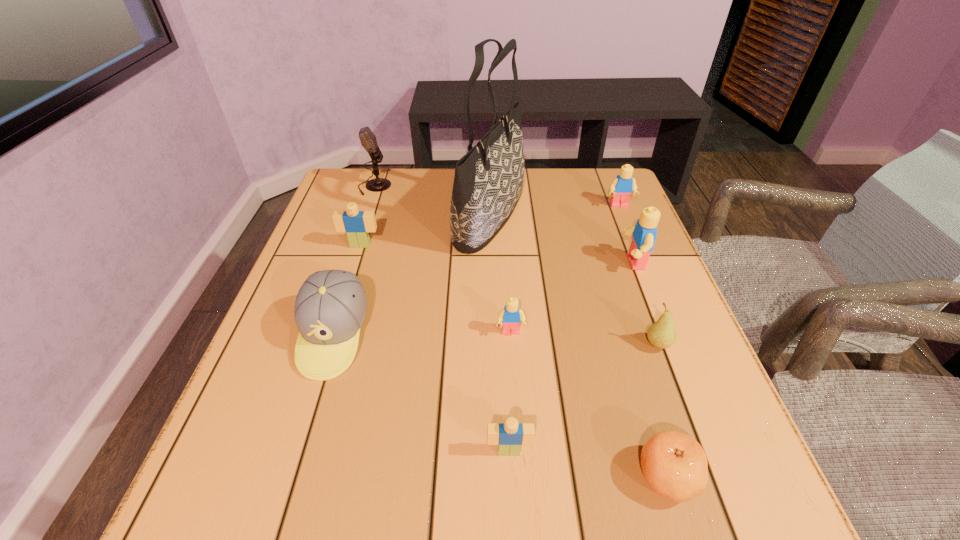
Identify the location of Lego located at the far edge. Image resolution: width=960 pixels, height=540 pixels. (622, 186).

At what (x,y) coordinates should I click in order to perform the action: click on object that is at the near edge. Please return your answer as a coordinate pair (x, y). This screenshot has height=540, width=960. Looking at the image, I should click on (674, 465).

Identify the location of microphone located in the left edge section of the desktop. (368, 140).

You are a GUI agent. You are given a task and a screenshot of the screen. Output one action in this format:
    pyautogui.click(x=<x>, y=<y>)
    Task: Click on the Lego that is at the left edge
    
    Given the screenshot: What is the action you would take?
    pyautogui.click(x=356, y=224)

This screenshot has width=960, height=540. What are the coordinates of `baseball cap located at the left edge` in the screenshot? It's located at (330, 308).

This screenshot has width=960, height=540. What are the coordinates of `pear that is at the right edge` in the screenshot? It's located at (662, 334).

The width and height of the screenshot is (960, 540). In order to click on clementine that is at the right edge in this screenshot , I will do `click(674, 465)`.

You are a GUI agent. You are given a task and a screenshot of the screen. Output one action in this format:
    pyautogui.click(x=<x>, y=<y>)
    Task: Click on the object present at the far left corner
    
    Given the screenshot: What is the action you would take?
    pyautogui.click(x=368, y=140)

The height and width of the screenshot is (540, 960). I want to click on object situated at the far right corner, so coord(622,186).

The height and width of the screenshot is (540, 960). In order to click on object located at the near right corner in this screenshot , I will do `click(674, 465)`.